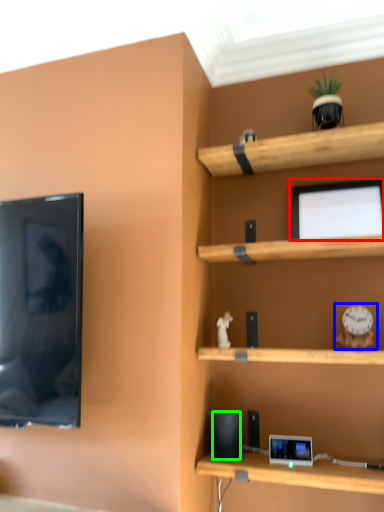
Question: Considering the real-world distances, which object is closest to computer monitor (highlighted by a red box)? toy (highlighted by a blue box) or speaker (highlighted by a green box).

Choices:
 (A) toy
 (B) speaker

Answer: (A)